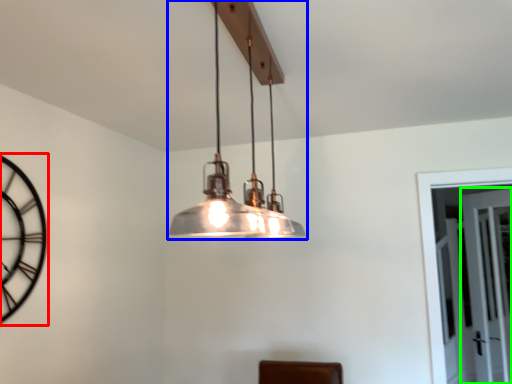
Question: Which is farther away from clock (highlighted by a red box)? lamp (highlighted by a blue box) or glass door (highlighted by a green box)?

Choices:
 (A) lamp
 (B) glass door

Answer: (B)